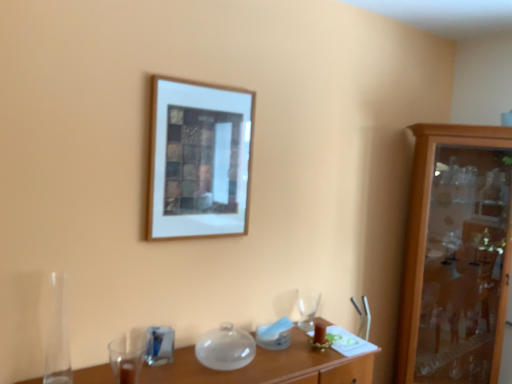
Question: From a real-world perspective, is transparent glass vase at lower left beneath blue glass at lower left, the 1th tableware in the front-to-back sequence?

Choices:
 (A) yes
 (B) no

Answer: (B)

Question: From the image's perspective, is transparent glass vase at lower left above blue glass at lower left, the first tableware positioned from the left?

Choices:
 (A) no
 (B) yes

Answer: (B)

Question: Is blue glass at lower left, the 2th tableware in the back-to-front sequence, at the back of transparent glass vase at lower left?

Choices:
 (A) yes
 (B) no

Answer: (B)

Question: Does transparent glass vase at lower left lie in front of blue glass at lower left, the 2th tableware in the back-to-front sequence?

Choices:
 (A) yes
 (B) no

Answer: (A)

Question: Would you say blue glass at lower left, the 1th tableware in the front-to-back sequence, is part of transparent glass vase at lower left's contents?

Choices:
 (A) yes
 (B) no

Answer: (B)

Question: Does transparent glass vase at lower left appear on the right side of blue glass at lower left, the 1th tableware in the front-to-back sequence?

Choices:
 (A) yes
 (B) no

Answer: (B)

Question: Is wooden picture frame at upper center next to blue glass at lower left, the first tableware positioned from the left?

Choices:
 (A) no
 (B) yes

Answer: (A)

Question: Considering the relative sizes of wooden picture frame at upper center and blue glass at lower left, the 1th tableware in the front-to-back sequence, in the image provided, is wooden picture frame at upper center smaller than blue glass at lower left, the 1th tableware in the front-to-back sequence,?

Choices:
 (A) yes
 (B) no

Answer: (B)

Question: Would you consider wooden picture frame at upper center to be distant from blue glass at lower left, the 2th tableware positioned from the right?

Choices:
 (A) yes
 (B) no

Answer: (B)

Question: Can you confirm if wooden picture frame at upper center is positioned to the right of blue glass at lower left, the 1th tableware in the front-to-back sequence?

Choices:
 (A) no
 (B) yes

Answer: (B)

Question: Does wooden picture frame at upper center have a greater height compared to blue glass at lower left, the 2th tableware positioned from the right?

Choices:
 (A) no
 (B) yes

Answer: (B)

Question: Can you confirm if wooden picture frame at upper center is bigger than blue glass at lower left, the 2th tableware in the back-to-front sequence?

Choices:
 (A) yes
 (B) no

Answer: (A)

Question: Is wooden cabinet at right turned away from blue glass at lower left, the 2th tableware in the back-to-front sequence?

Choices:
 (A) yes
 (B) no

Answer: (B)